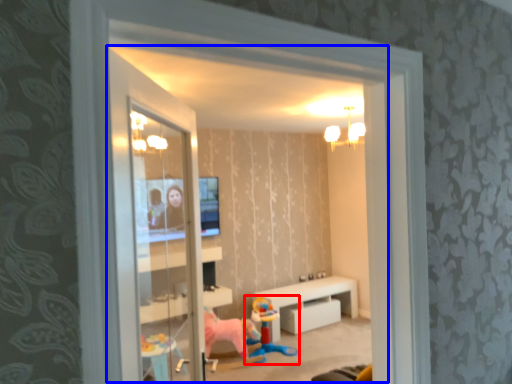
Question: Which point is closer to the camera, toy (highlighted by a red box) or window (highlighted by a blue box)?

Choices:
 (A) toy
 (B) window

Answer: (B)